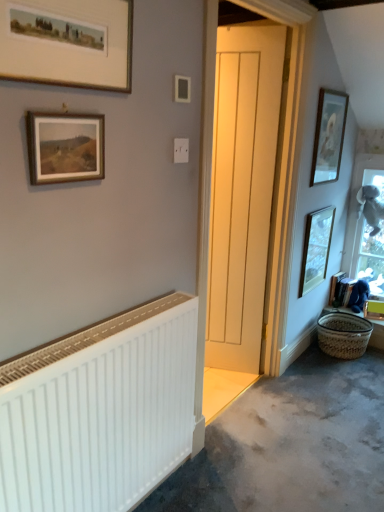
Question: Considering the relative positions of white wooden door at center and woven straw basket at lower right in the image provided, is white wooden door at center in front of woven straw basket at lower right?

Choices:
 (A) yes
 (B) no

Answer: (A)

Question: Does white wooden door at center have a greater width compared to woven straw basket at lower right?

Choices:
 (A) no
 (B) yes

Answer: (A)

Question: Is white wooden door at center taller than woven straw basket at lower right?

Choices:
 (A) no
 (B) yes

Answer: (B)

Question: Is white wooden door at center touching woven straw basket at lower right?

Choices:
 (A) yes
 (B) no

Answer: (B)

Question: Does white wooden door at center appear on the right side of woven straw basket at lower right?

Choices:
 (A) yes
 (B) no

Answer: (B)

Question: Considering the positions of point (377, 245) and point (102, 176), is point (377, 245) closer or farther from the camera than point (102, 176)?

Choices:
 (A) farther
 (B) closer

Answer: (A)

Question: Would you say clear glass window at right is inside or outside wooden-framed painting at upper left, which is counted as the 2th picture frame, starting from the front?

Choices:
 (A) inside
 (B) outside

Answer: (B)

Question: In the image, is clear glass window at right on the left side or the right side of wooden-framed painting at upper left, which is the fourth picture frame in right-to-left order?

Choices:
 (A) right
 (B) left

Answer: (A)

Question: In terms of size, does clear glass window at right appear bigger or smaller than wooden-framed painting at upper left, which appears as the 1th picture frame when viewed from the left?

Choices:
 (A) small
 (B) big

Answer: (B)

Question: Relative to white matte radiator at lower left, is gray carpet at lower right in front or behind?

Choices:
 (A) behind
 (B) front

Answer: (A)

Question: Is point (223, 488) positioned closer to the camera than point (112, 445)?

Choices:
 (A) farther
 (B) closer

Answer: (A)

Question: From a real-world perspective, is gray carpet at lower right positioned above or below white matte radiator at lower left?

Choices:
 (A) above
 (B) below

Answer: (B)

Question: Is gray carpet at lower right inside or outside of white matte radiator at lower left?

Choices:
 (A) inside
 (B) outside

Answer: (B)

Question: Is point (223, 196) positioned closer to the camera than point (33, 136)?

Choices:
 (A) closer
 (B) farther

Answer: (B)

Question: Choose the correct answer: Is white wooden door at center inside wooden-framed painting at upper left, which is counted as the 2th picture frame, starting from the front, or outside it?

Choices:
 (A) inside
 (B) outside

Answer: (B)